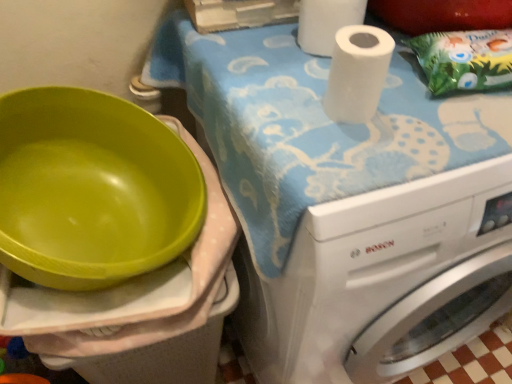
The height and width of the screenshot is (384, 512). I want to click on vacant region in front of white matte paper towel at upper right, the 2th paper towel positioned from the front, so click(329, 122).